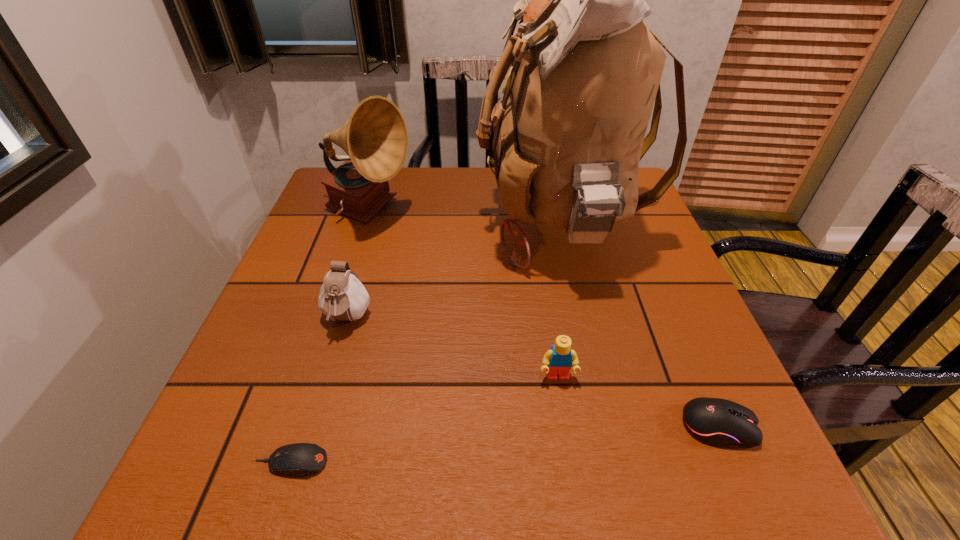
At what (x,y) coordinates should I click in order to perform the action: click on vacant space at the near edge of the desktop. Please return your answer as a coordinate pair (x, y). Image resolution: width=960 pixels, height=540 pixels. Looking at the image, I should click on (643, 478).

Locate an element on the screen. free space at the left edge of the desktop is located at coordinates (270, 331).

At what (x,y) coordinates should I click in order to perform the action: click on blank space at the right edge. Please return your answer as a coordinate pair (x, y). Image resolution: width=960 pixels, height=540 pixels. Looking at the image, I should click on (693, 313).

In the image, there is a desktop. At what (x,y) coordinates should I click in order to perform the action: click on vacant space at the near left corner. Please return your answer as a coordinate pair (x, y). Looking at the image, I should click on (234, 469).

The image size is (960, 540). In the image, there is a desktop. In order to click on vacant space at the near right corner in this screenshot , I will do `click(684, 482)`.

This screenshot has width=960, height=540. In order to click on vacant area between the fourth tallest object and the pouch in this screenshot , I will do point(452,348).

Identify the location of free space between the right computer mouse and the third tallest object. The image size is (960, 540). (533, 373).

Where is `vacant space that is in between the shortest object and the fourth farthest object`? The height and width of the screenshot is (540, 960). vacant space that is in between the shortest object and the fourth farthest object is located at coordinates (424, 420).

What are the coordinates of `blank region between the Lego and the right computer mouse` in the screenshot? It's located at (637, 402).

Find the location of a particular element. free point between the left computer mouse and the phonograph record is located at coordinates (331, 338).